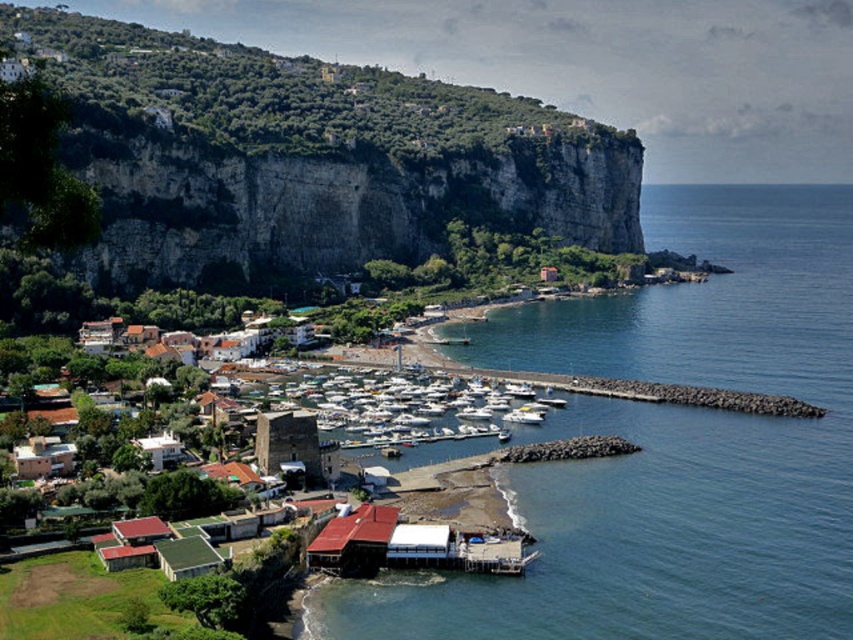
Can you confirm if rugged stone cliff at upper left is shorter than white matte boats at center?

Result: In fact, rugged stone cliff at upper left may be taller than white matte boats at center.

Does point (627, 221) come behind point (437, 403)?

Yes, point (627, 221) is behind point (437, 403).

Where is `rugged stone cliff at upper left`? This screenshot has height=640, width=853. rugged stone cliff at upper left is located at coordinates (305, 157).

Is blue water at lower center above wooden pier at lower center?

Yes.

Measure the distance between blue water at lower center and wooden pier at lower center.

The distance of blue water at lower center from wooden pier at lower center is 57.89 meters.

This screenshot has width=853, height=640. In order to click on blue water at lower center in this screenshot , I will do `click(671, 448)`.

Is point (315, 560) less distant than point (347, 563)?

Yes, point (315, 560) is in front of point (347, 563).

Based on the photo, who is positioned more to the left, wooden pier at lower center or red corrugated metal hut at lower center?

Positioned to the left is red corrugated metal hut at lower center.

Measure the distance between point (x=413, y=545) and camera.

Point (x=413, y=545) and camera are 426.22 feet apart.

Identify the location of wooden pier at lower center. (409, 545).